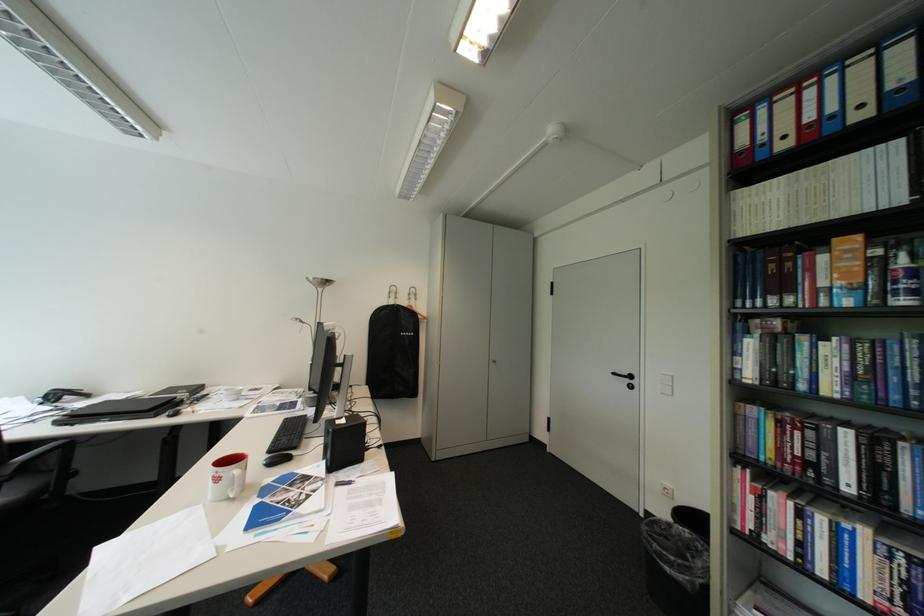
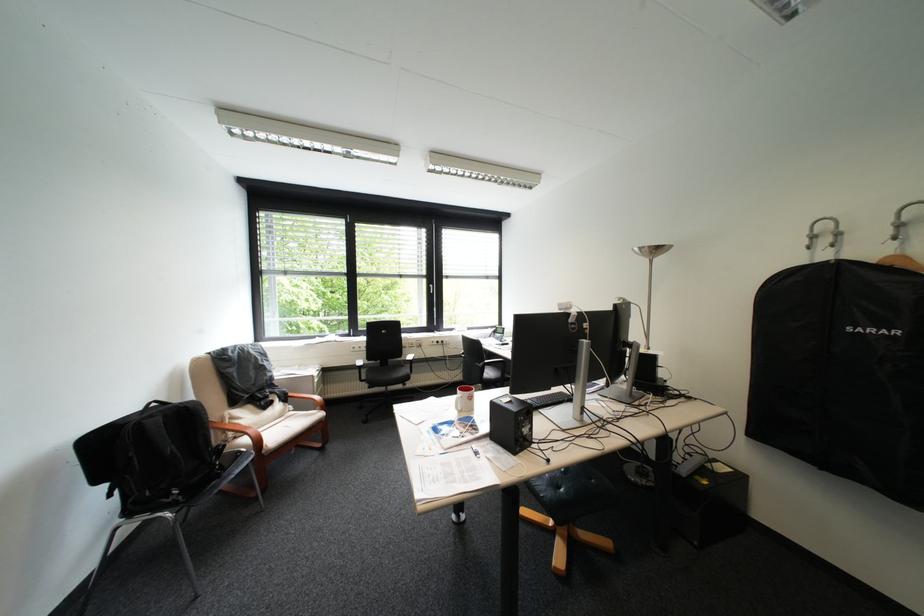
The point at (419, 334) is marked in the first image. Where is the corresponding point in the second image?

(883, 331)